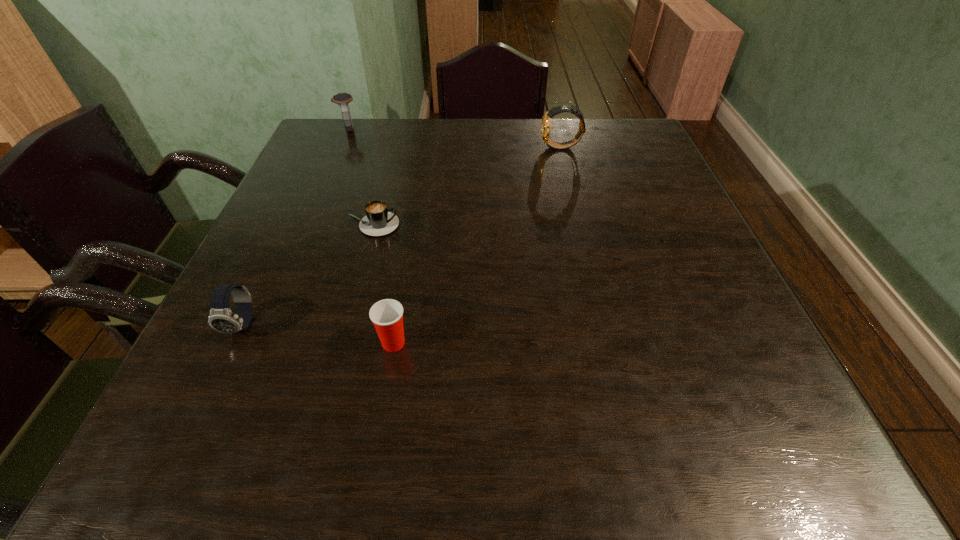
You are a GUI agent. You are given a task and a screenshot of the screen. Output one action in this format:
    pyautogui.click(x=<x>, y=<y>)
    Task: Click on the vacant space that satisfies the following two spatial constraints: 1. with the handle on the side of the second object from right to left; 2. on the left side of the shortest object
    The width and height of the screenshot is (960, 540).
    Given the screenshot: What is the action you would take?
    pyautogui.click(x=341, y=343)